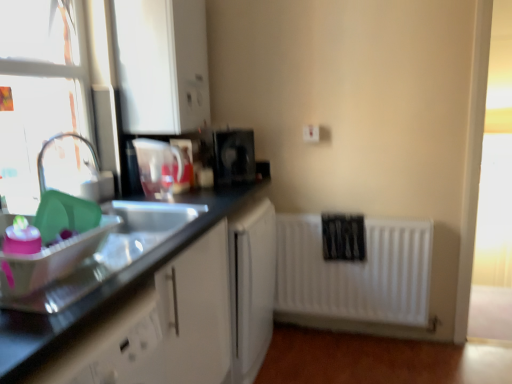
The height and width of the screenshot is (384, 512). What do you see at coordinates (158, 165) in the screenshot?
I see `translucent plastic pitcher at upper center, acting as the 2th appliance starting from the right` at bounding box center [158, 165].

Measure the distance between black plastic coffee maker at center, the second appliance positioned from the left, and camera.

black plastic coffee maker at center, the second appliance positioned from the left, is 7.35 feet away from camera.

Find the location of `white matte radiator at lower right`. white matte radiator at lower right is located at coordinates (355, 273).

Locate an element on the screen. translucent plastic pitcher at upper center, which is the first appliance in front-to-back order is located at coordinates (158, 165).

Consider the image. Is black plastic coffee maker at center, which is the 1th appliance from right to left, with black granite sink at left?

No.

Is black plastic coffee maker at center, which appears as the 1th appliance when viewed from the back, wider or thinner than black granite sink at left?

black plastic coffee maker at center, which appears as the 1th appliance when viewed from the back, is thinner than black granite sink at left.

What's the angular difference between black plastic coffee maker at center, which appears as the 1th appliance when viewed from the back, and black granite sink at left's facing directions?

They differ by 43 degrees in their facing directions.

Would you say black plastic coffee maker at center, which appears as the 1th appliance when viewed from the back, contains black granite sink at left?

That's incorrect, black granite sink at left is not inside black plastic coffee maker at center, which appears as the 1th appliance when viewed from the back.

From a real-world perspective, is translucent plastic pitcher at upper center, the 2th appliance viewed from the back, located beneath clear glass window at left?

Indeed, from a real-world perspective, translucent plastic pitcher at upper center, the 2th appliance viewed from the back, is positioned beneath clear glass window at left.

You are a GUI agent. You are given a task and a screenshot of the screen. Output one action in this format:
    pyautogui.click(x=<x>, y=<y>)
    Task: Click on the 1st appliance behind when counting from the clear glass window at left
    
    Given the screenshot: What is the action you would take?
    pyautogui.click(x=158, y=165)

Consider the image. Is translucent plastic pitcher at upper center, the 2th appliance viewed from the back, wider or thinner than clear glass window at left?

translucent plastic pitcher at upper center, the 2th appliance viewed from the back, is wider than clear glass window at left.

Does point (251, 162) come behind point (158, 148)?

Yes, it is.

Is black plastic coffee maker at center, which is the 1th appliance from right to left, taller than translucent plastic pitcher at upper center, which is the first appliance in front-to-back order?

In fact, black plastic coffee maker at center, which is the 1th appliance from right to left, may be shorter than translucent plastic pitcher at upper center, which is the first appliance in front-to-back order.

How different are the orientations of black plastic coffee maker at center, which appears as the 1th appliance when viewed from the back, and translucent plastic pitcher at upper center, the 2th appliance viewed from the back, in degrees?

They differ by 43 degrees in their facing directions.

From the image's perspective, which is above, clear glass window at left or translucent plastic pitcher at upper center, which is the first appliance in front-to-back order?

clear glass window at left is shown above in the image.

Image resolution: width=512 pixels, height=384 pixels. Identify the location of appliance that is the 1st object directly below the clear glass window at left (from a real-world perspective). (158, 165).

Considering the points (39, 150) and (158, 185), which point is in front, point (39, 150) or point (158, 185)?

Positioned in front is point (39, 150).

From their relative heights in the image, would you say clear glass window at left is taller or shorter than translucent plastic pitcher at upper center, the 1th appliance viewed from the left?

In the image, clear glass window at left appears to be taller than translucent plastic pitcher at upper center, the 1th appliance viewed from the left.

Is translucent plastic pitcher at upper center, acting as the 2th appliance starting from the right, in front of black granite sink at left?

No, translucent plastic pitcher at upper center, acting as the 2th appliance starting from the right, is further to the viewer.

Which is closer to the camera, (x=168, y=157) or (x=198, y=235)?

The point (x=198, y=235) is closer.

How far apart are translucent plastic pitcher at upper center, which is the first appliance in front-to-back order, and black granite sink at left?

They are 14.70 inches apart.

Which object is wider, translucent plastic pitcher at upper center, which is the first appliance in front-to-back order, or black granite sink at left?

With larger width is black granite sink at left.

Considering the positions of point (291, 251) and point (212, 213), is point (291, 251) closer or farther from the camera than point (212, 213)?

Point (291, 251) is positioned farther from the camera compared to point (212, 213).

Is white matte radiator at lower right bigger or smaller than black granite sink at left?

Clearly, white matte radiator at lower right is smaller in size than black granite sink at left.

What's the angular difference between white matte radiator at lower right and black granite sink at left's facing directions?

The angle between the facing direction of white matte radiator at lower right and the facing direction of black granite sink at left is 90 degrees.

Identify the location of radiator behind the black granite sink at left. (355, 273).

Does clear glass window at left turn towards black granite sink at left?

No.

In terms of size, does clear glass window at left appear bigger or smaller than black granite sink at left?

In the image, clear glass window at left appears to be smaller than black granite sink at left.

Between clear glass window at left and black granite sink at left, which one has larger width?

Wider between the two is black granite sink at left.

From a real-world perspective, which appliance is the 1st one above the black granite sink at left? Please provide its 2D coordinates.

[(234, 156)]

Find the location of `window frame located in front of the translucent plastic pitcher at upper center, the 1th appliance viewed from the left`. window frame located in front of the translucent plastic pitcher at upper center, the 1th appliance viewed from the left is located at coordinates (38, 90).

Which object lies nearer to the anchor point white matte radiator at lower right, white plastic electric outlet at upper center or clear glass window at left?

Among the two, white plastic electric outlet at upper center is located nearer to white matte radiator at lower right.

Considering their positions, is white matte radiator at lower right positioned further to black granite sink at left than translucent plastic pitcher at upper center, the 1th appliance viewed from the left?

white matte radiator at lower right is further to black granite sink at left.

Considering their positions, is black granite sink at left positioned further to translucent plastic pitcher at upper center, the 2th appliance viewed from the back, than clear glass window at left?

clear glass window at left lies further to translucent plastic pitcher at upper center, the 2th appliance viewed from the back, than the other object.

Looking at the image, which one is located closer to translucent plastic pitcher at upper center, acting as the 2th appliance starting from the right, clear glass window at left or black plastic coffee maker at center, which is counted as the second appliance, starting from the front?

Among the two, black plastic coffee maker at center, which is counted as the second appliance, starting from the front, is located nearer to translucent plastic pitcher at upper center, acting as the 2th appliance starting from the right.

Estimate the real-world distances between objects in this image. Which object is further from black granite sink at left, translucent plastic pitcher at upper center, the 2th appliance viewed from the back, or white matte radiator at lower right?

white matte radiator at lower right.

Consider the image. Looking at the image, which one is located closer to black granite sink at left, translucent plastic pitcher at upper center, the 2th appliance viewed from the back, or white plastic electric outlet at upper center?

translucent plastic pitcher at upper center, the 2th appliance viewed from the back.

When comparing their distances from black granite sink at left, does translucent plastic pitcher at upper center, the 1th appliance viewed from the left, or black plastic coffee maker at center, the second appliance positioned from the left, seem closer?

black plastic coffee maker at center, the second appliance positioned from the left, is positioned closer to the anchor black granite sink at left.

Looking at the image, which one is located closer to clear glass window at left, black granite sink at left or white matte radiator at lower right?

black granite sink at left lies closer to clear glass window at left than the other object.

I want to click on appliance situated between translucent plastic pitcher at upper center, the 1th appliance viewed from the left, and white matte radiator at lower right from left to right, so click(234, 156).

Where is `electric outlet between clear glass window at left and white matte radiator at lower right from left to right`? Image resolution: width=512 pixels, height=384 pixels. electric outlet between clear glass window at left and white matte radiator at lower right from left to right is located at coordinates (311, 133).

Locate an element on the screen. This screenshot has width=512, height=384. appliance between translucent plastic pitcher at upper center, the 2th appliance viewed from the back, and white plastic electric outlet at upper center from left to right is located at coordinates (234, 156).

Find the location of a particular element. The height and width of the screenshot is (384, 512). countertop between clear glass window at left and white matte radiator at lower right is located at coordinates (108, 286).